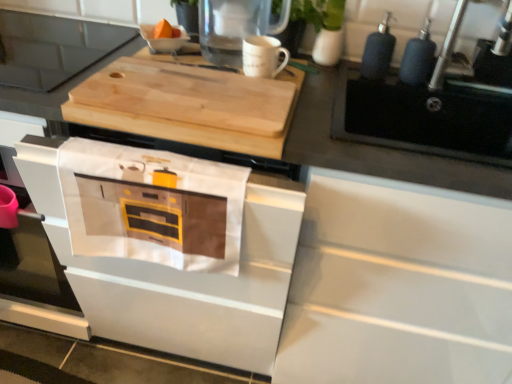
Question: Does white cotton towel at lower center appear on the right side of metallic silver faucet at upper right?

Choices:
 (A) yes
 (B) no

Answer: (B)

Question: Is white cotton towel at lower center positioned beyond the bounds of metallic silver faucet at upper right?

Choices:
 (A) yes
 (B) no

Answer: (A)

Question: Could you tell me if white cotton towel at lower center is facing metallic silver faucet at upper right?

Choices:
 (A) yes
 (B) no

Answer: (B)

Question: Is white cotton towel at lower center turned away from metallic silver faucet at upper right?

Choices:
 (A) yes
 (B) no

Answer: (B)

Question: Is the position of white cotton towel at lower center more distant than that of metallic silver faucet at upper right?

Choices:
 (A) no
 (B) yes

Answer: (A)

Question: Visually, is wooden cutting board at upper center positioned to the left or to the right of clear glass pitcher at upper center?

Choices:
 (A) right
 (B) left

Answer: (B)

Question: Is point (53, 66) positioned closer to the camera than point (234, 11)?

Choices:
 (A) farther
 (B) closer

Answer: (A)

Question: Considering the positions of wooden cutting board at upper center and clear glass pitcher at upper center in the image, is wooden cutting board at upper center taller or shorter than clear glass pitcher at upper center?

Choices:
 (A) tall
 (B) short

Answer: (B)

Question: Looking at the image, does wooden cutting board at upper center seem bigger or smaller compared to clear glass pitcher at upper center?

Choices:
 (A) small
 (B) big

Answer: (B)

Question: From the image's perspective, is natural wood cutting board at upper center located above or below white matte oven at center?

Choices:
 (A) below
 (B) above

Answer: (B)

Question: Does point (223, 105) appear closer or farther from the camera than point (89, 198)?

Choices:
 (A) farther
 (B) closer

Answer: (A)

Question: Looking at their shapes, would you say natural wood cutting board at upper center is wider or thinner than white matte oven at center?

Choices:
 (A) thin
 (B) wide

Answer: (A)

Question: Choose the correct answer: Is natural wood cutting board at upper center inside white matte oven at center or outside it?

Choices:
 (A) inside
 (B) outside

Answer: (B)

Question: Is white cotton towel at lower center spatially inside wooden cutting board at upper center, or outside of it?

Choices:
 (A) inside
 (B) outside

Answer: (B)

Question: In the image, is white cotton towel at lower center positioned in front of or behind wooden cutting board at upper center?

Choices:
 (A) behind
 (B) front

Answer: (B)